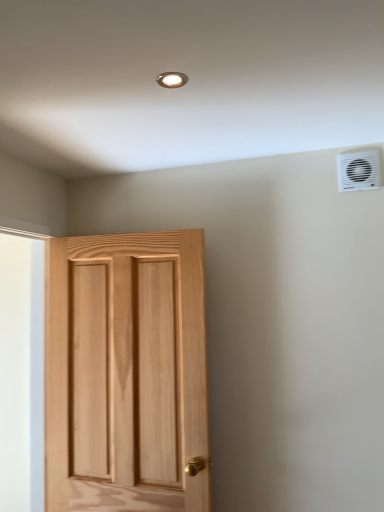
Question: Is matte silver light fixture at upper center closer to camera compared to white plastic air conditioning unit at upper right?

Choices:
 (A) yes
 (B) no

Answer: (A)

Question: From the image's perspective, is matte silver light fixture at upper center beneath white plastic air conditioning unit at upper right?

Choices:
 (A) no
 (B) yes

Answer: (A)

Question: Are matte silver light fixture at upper center and white plastic air conditioning unit at upper right far apart?

Choices:
 (A) no
 (B) yes

Answer: (A)

Question: Is matte silver light fixture at upper center positioned with its back to white plastic air conditioning unit at upper right?

Choices:
 (A) no
 (B) yes

Answer: (A)

Question: From a real-world perspective, does matte silver light fixture at upper center sit lower than white plastic air conditioning unit at upper right?

Choices:
 (A) yes
 (B) no

Answer: (B)

Question: Is point (370, 164) closer or farther from the camera than point (167, 266)?

Choices:
 (A) closer
 (B) farther

Answer: (A)

Question: From a real-world perspective, is white plastic air conditioning unit at upper right positioned above or below natural wood door at left?

Choices:
 (A) above
 (B) below

Answer: (A)

Question: Based on their positions, is white plastic air conditioning unit at upper right located to the left or right of natural wood door at left?

Choices:
 (A) left
 (B) right

Answer: (B)

Question: Is white plastic air conditioning unit at upper right bigger or smaller than natural wood door at left?

Choices:
 (A) small
 (B) big

Answer: (A)

Question: Is point tap(167, 81) positioned closer to the camera than point tap(117, 408)?

Choices:
 (A) farther
 (B) closer

Answer: (B)

Question: Would you say matte silver light fixture at upper center is to the left or to the right of natural wood door at left in the picture?

Choices:
 (A) right
 (B) left

Answer: (A)

Question: In terms of height, does matte silver light fixture at upper center look taller or shorter compared to natural wood door at left?

Choices:
 (A) tall
 (B) short

Answer: (B)

Question: Considering the positions of matte silver light fixture at upper center and natural wood door at left in the image, is matte silver light fixture at upper center wider or thinner than natural wood door at left?

Choices:
 (A) wide
 (B) thin

Answer: (B)

Question: Is point (362, 177) closer or farther from the camera than point (175, 74)?

Choices:
 (A) closer
 (B) farther

Answer: (B)

Question: In the image, is white plastic air conditioning unit at upper right positioned in front of or behind matte silver light fixture at upper center?

Choices:
 (A) front
 (B) behind

Answer: (B)